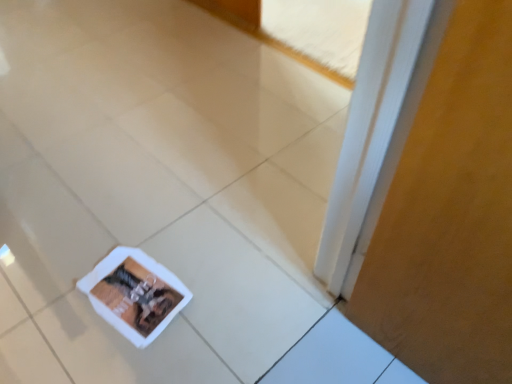
Where is `free location above white glossy magazine at lower left (from a real-world perspective)`? free location above white glossy magazine at lower left (from a real-world perspective) is located at coordinates (147, 299).